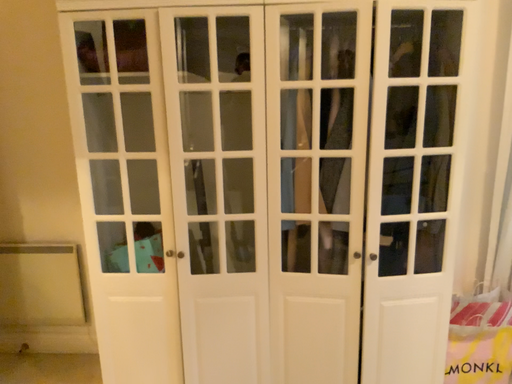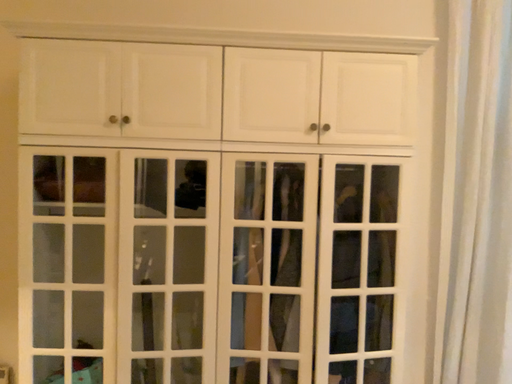
Question: Which way did the camera rotate in the video?

Choices:
 (A) rotated downward
 (B) rotated upward

Answer: (B)